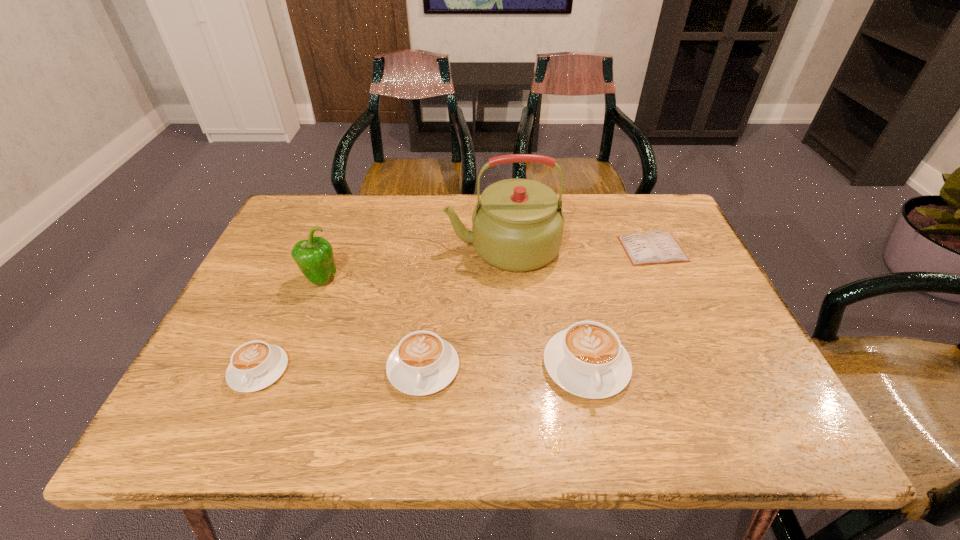
This screenshot has height=540, width=960. I want to click on cappuccino that is the closest to the kettle, so click(587, 359).

The width and height of the screenshot is (960, 540). In order to click on cappuccino that is the closest to the rightmost object in this screenshot , I will do `click(587, 359)`.